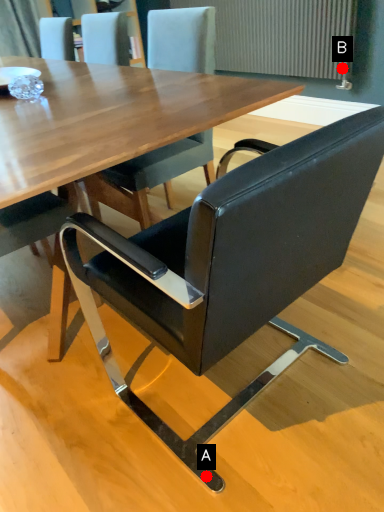
Question: Two points are circled on the image, labeled by A and B beside each circle. Which of the following is the closest to the observer?

Choices:
 (A) A is closer
 (B) B is closer

Answer: (A)